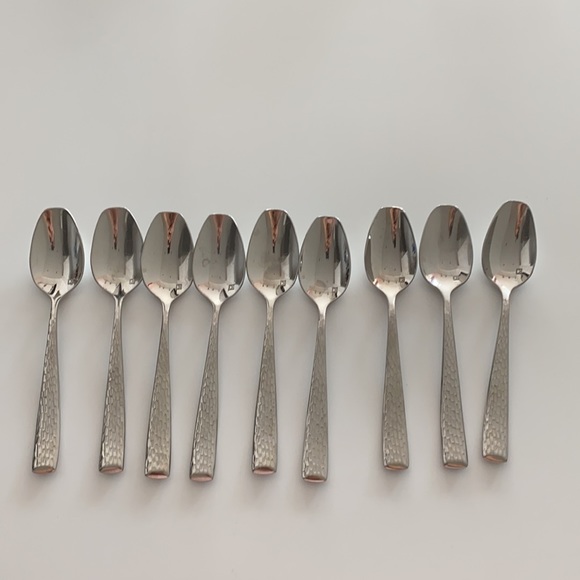
Image resolution: width=580 pixels, height=580 pixels. In order to click on bowl of spoon in this screenshot , I will do `click(58, 264)`, `click(108, 260)`, `click(164, 256)`, `click(218, 259)`, `click(262, 257)`, `click(321, 261)`, `click(392, 256)`, `click(452, 251)`, `click(523, 255)`.